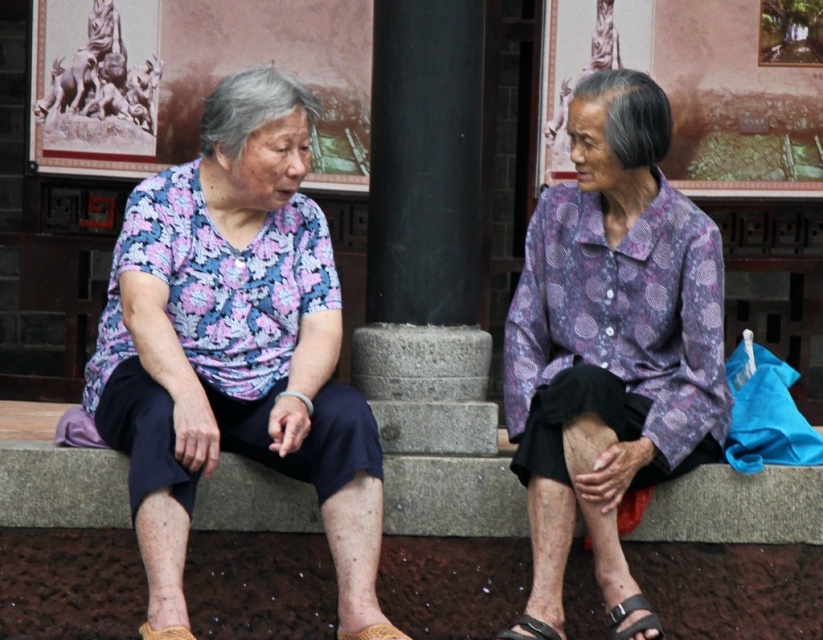
You are a fashion designer observing two elderly women sitting on a stone bench. You notice their sandals. Which sandal, the black leather sandal at lower right or the yellow knitted sandal at lower left, would be more suitable for a formal event?

The black leather sandal at lower right is much taller than the yellow knitted sandal at lower left, making it more suitable for a formal event due to its more structured and elegant appearance.

Based on the photo, you are standing at the point with coordinates point (405, 634) and want to walk to the point (608, 621). Which direction should you move to reach your destination?

To reach point (608, 621) from point (405, 634), you should move forward since point (608, 621) is in front of point (405, 634).

From the picture: You are standing at the origin of the coordinate system in this image. You need to determine the position of two points. Which point is closer to you, point (324, 342) or point (147, 627)?

Point (147, 627) is closer to you because it has a smaller y coordinate than point (324, 342). In a standard coordinate system, a smaller y value indicates a position closer to the viewer.